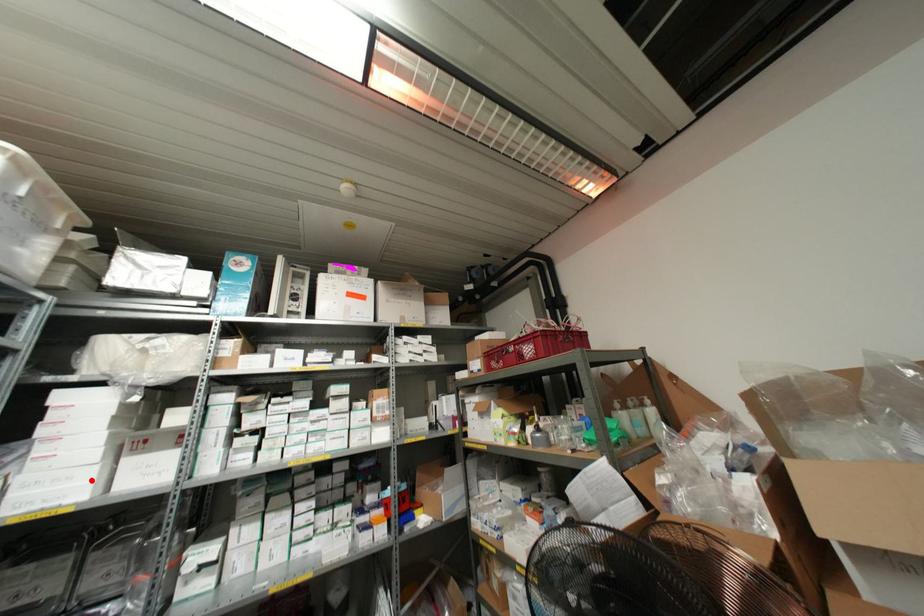
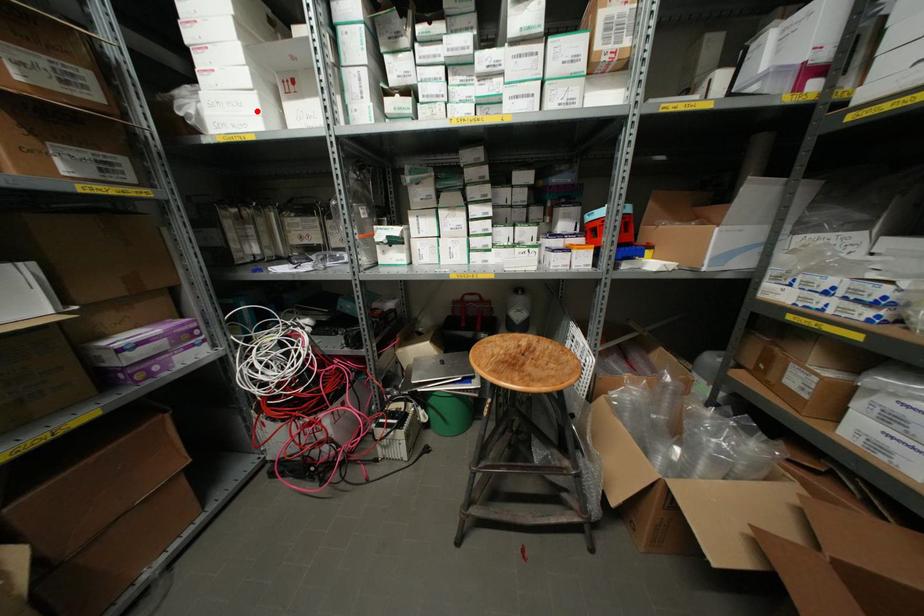
I am providing you with two images of the same scene from different viewpoints. A red point is marked on the first image and another point is marked on the second image. Is the red point in image1 aligned with the point shown in image2?

Yes